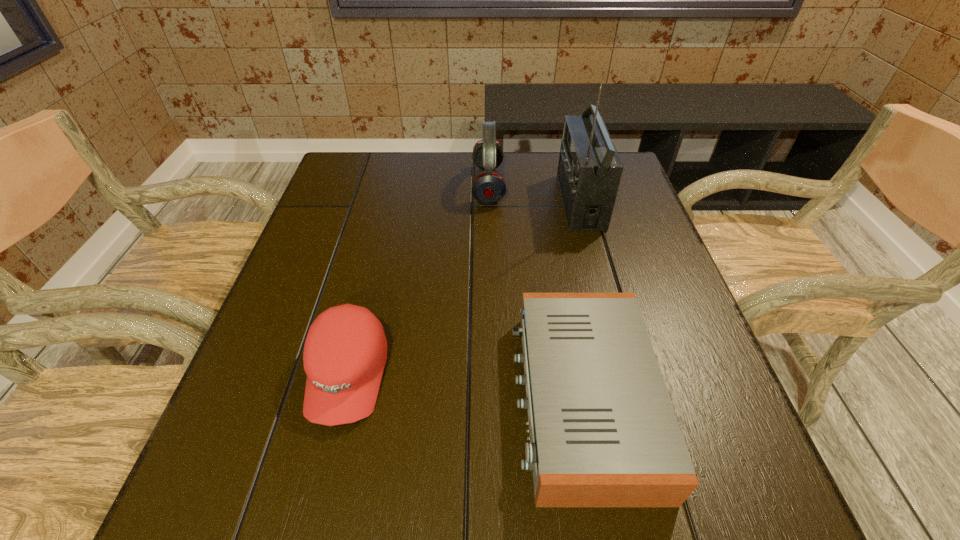
The image size is (960, 540). Find the location of `vacant point located between the second tallest object and the nearer radio receiver`. vacant point located between the second tallest object and the nearer radio receiver is located at coordinates (535, 292).

Locate an element on the screen. This screenshot has height=540, width=960. empty space that is in between the third shortest object and the cap is located at coordinates (418, 280).

This screenshot has height=540, width=960. I want to click on blank region between the leftmost object and the farther radio receiver, so click(x=464, y=288).

Identify the location of free space between the farther radio receiver and the second shortest object. (464, 288).

Locate an element on the screen. vacant space in between the tallest object and the third tallest object is located at coordinates click(464, 288).

You are a GUI agent. You are given a task and a screenshot of the screen. Output one action in this format:
    pyautogui.click(x=<x>, y=<y>)
    Task: Click on the vacant space that is in between the second shortest object and the third shortest object
    This screenshot has width=960, height=540.
    Given the screenshot: What is the action you would take?
    pyautogui.click(x=418, y=280)

Identify which object is located as the nearest to the taller radio receiver. Please provide its 2D coordinates. Your answer should be formatted as a tuple, i.e. [(x, y)], where the tuple contains the x and y coordinates of a point satisfying the conditions above.

[(488, 187)]

This screenshot has height=540, width=960. I want to click on the second closest object to the second tallest object, so click(x=603, y=432).

Find the location of a particular element. vacant region that satisfies the following two spatial constraints: 1. on the front panel of the taller radio receiver; 2. on the front-facing side of the leftmost object is located at coordinates (627, 375).

Where is `vacant space that satisfies the following two spatial constraints: 1. on the ear cups of the second tallest object; 2. on the front-facing side of the second shortest object`? The height and width of the screenshot is (540, 960). vacant space that satisfies the following two spatial constraints: 1. on the ear cups of the second tallest object; 2. on the front-facing side of the second shortest object is located at coordinates (492, 375).